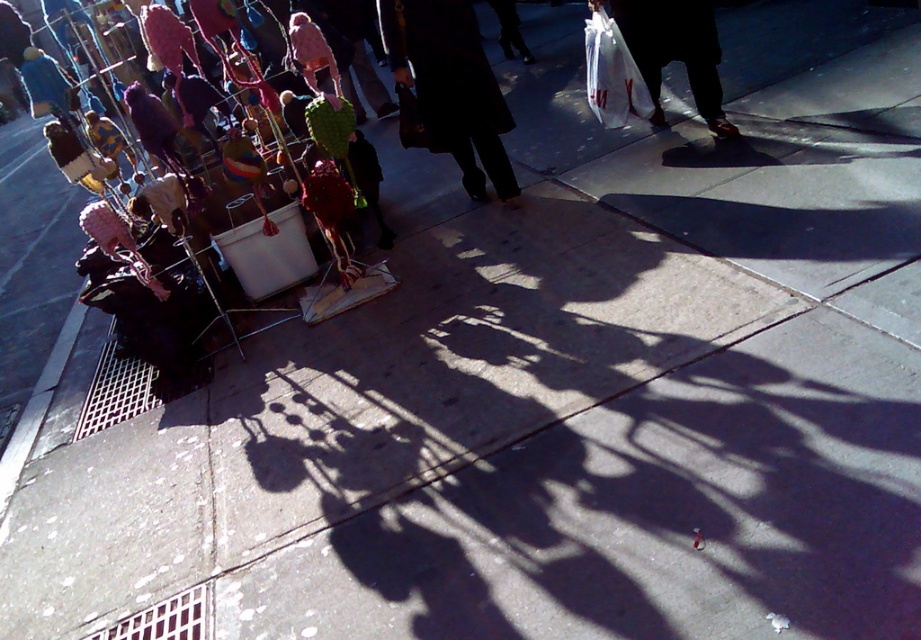
Who is shorter, dark matte coat at center or white plastic bag at center?

Standing shorter between the two is white plastic bag at center.

Does dark matte coat at center have a lesser height compared to white plastic bag at center?

→ No.

Which is in front, point (428, 17) or point (704, 92)?

Point (428, 17) is more forward.

The image size is (921, 640). I want to click on dark matte coat at center, so click(x=451, y=86).